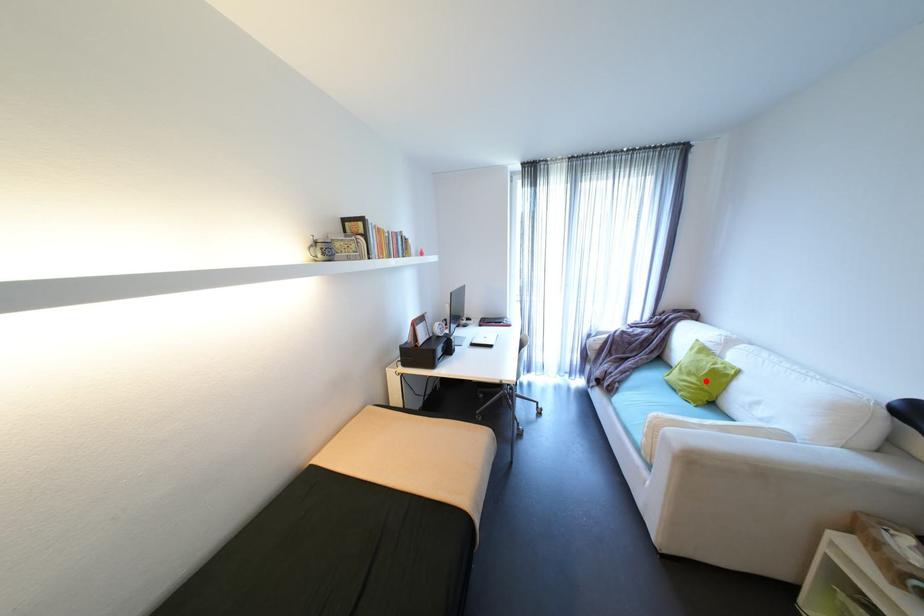
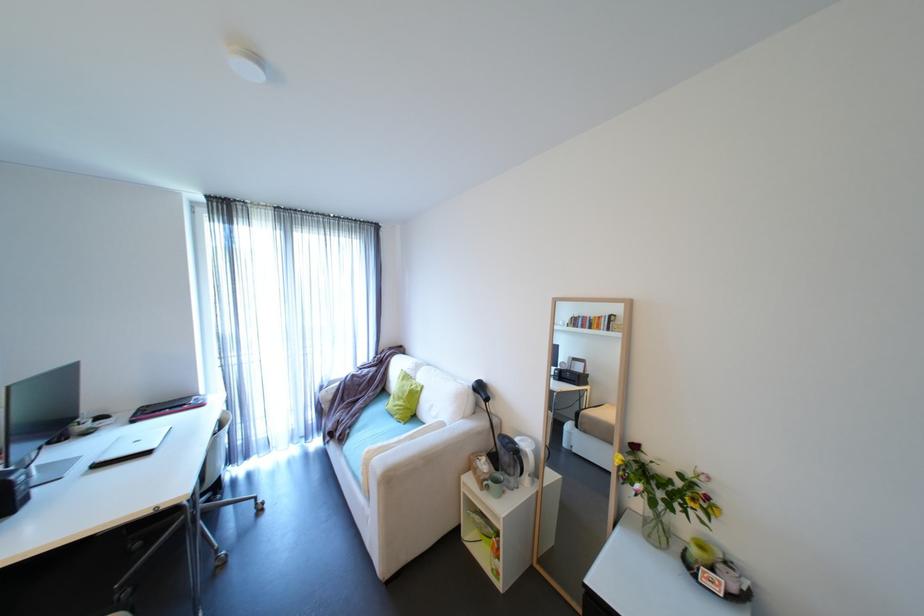
Question: I am providing you with two images of the same scene from different viewpoints. Given a red point in image1, look at the same physical point in image2. Is it:

Choices:
 (A) Closer to the viewpoint
 (B) Farther from the viewpoint

Answer: (B)